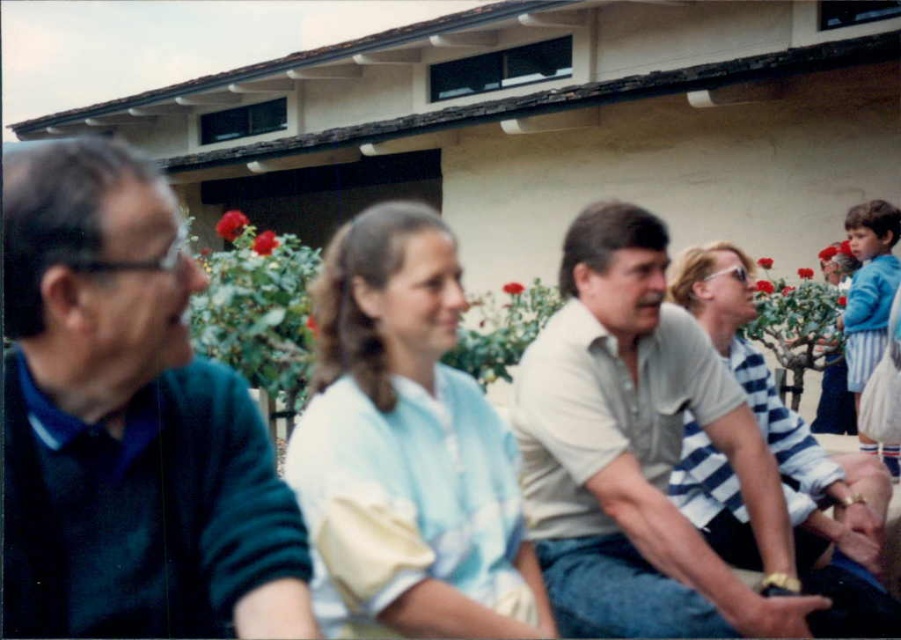
You are a photographer trying to capture a photo of the light beige shirt at center and the light blue fabric shirt at center. Which shirt should you focus on first if you want to ensure both are in focus without adjusting the camera settings?

The light beige shirt at center is positioned over the light blue fabric shirt at center, so focusing on the light beige shirt at center first would ensure both are in focus since it is closer to the camera.

Consider the image. You are a photographer trying to capture a group photo of the light beige shirt at center and the white striped shirt at right. Since you want them both in the frame, which direction should you move the camera to ensure both are visible?

The light beige shirt at center is positioned on the left side of white striped shirt at right, so moving the camera to the left would ensure both are visible in the frame.

You are standing at the point labeled point (8, 376) and want to walk to the point labeled point (344, 620). According to the image, will you have to walk towards the background or the foreground?

Since point (8, 376) is in front of point (344, 620), you will have to walk towards the background to reach it.